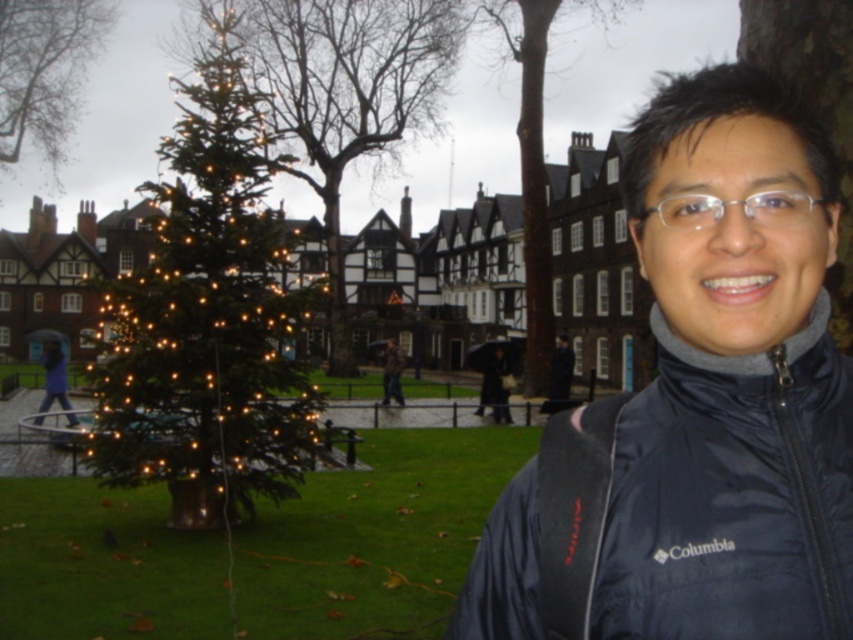
Question: Which object appears farthest from the camera in this image?

Choices:
 (A) green matte tree at upper left
 (B) clear plastic glasses at center
 (C) black matte jacket at lower right

Answer: (A)

Question: Which point appears closest to the camera in this image?

Choices:
 (A) (59, 156)
 (B) (236, 518)

Answer: (B)

Question: Can you confirm if green matte christmas tree at center is positioned to the right of clear plastic glasses at center?

Choices:
 (A) no
 (B) yes

Answer: (B)

Question: Can you confirm if matte black jacket at right is positioned to the left of green matte tree at upper left?

Choices:
 (A) no
 (B) yes

Answer: (A)

Question: Which object appears farthest from the camera in this image?

Choices:
 (A) brown textured tree at center
 (B) green matte tree at upper left

Answer: (B)

Question: Is clear plastic glasses at center smaller than dark gray jacket at center?

Choices:
 (A) yes
 (B) no

Answer: (A)